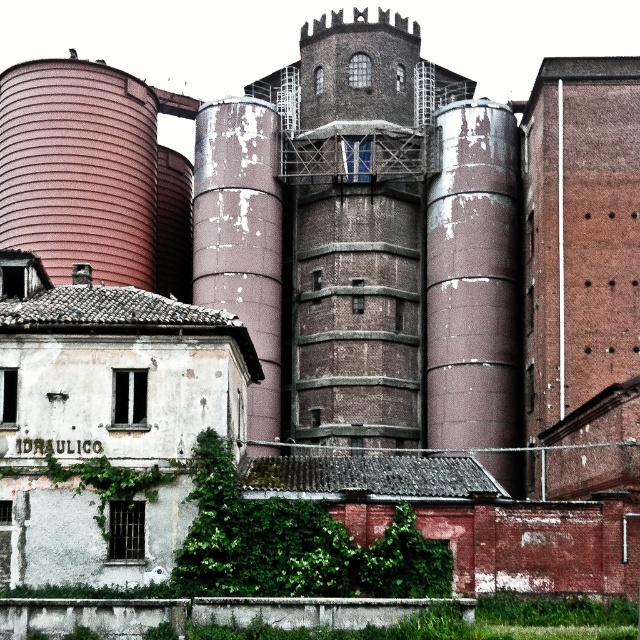
Question: Which of these objects is positioned closest to the rusty metallic silo at center?

Choices:
 (A) green leafy plant at lower center
 (B) green ivy at lower left

Answer: (A)

Question: Is rusty metallic silo at center above green leafy plant at lower center?

Choices:
 (A) no
 (B) yes

Answer: (B)

Question: Which object is the farthest from the rusty metallic silo at center?

Choices:
 (A) green ivy at lower left
 (B) green leafy plant at lower center

Answer: (A)

Question: Does rusty metallic silo at center have a larger size compared to green ivy at lower left?

Choices:
 (A) no
 (B) yes

Answer: (B)

Question: In this image, where is rusty metal silo at center located relative to green ivy at lower left?

Choices:
 (A) left
 (B) right

Answer: (B)

Question: Which point is closer to the camera?

Choices:
 (A) rusty metallic silo at center
 (B) rusty metal silo at center
 (C) green ivy at lower left

Answer: (C)